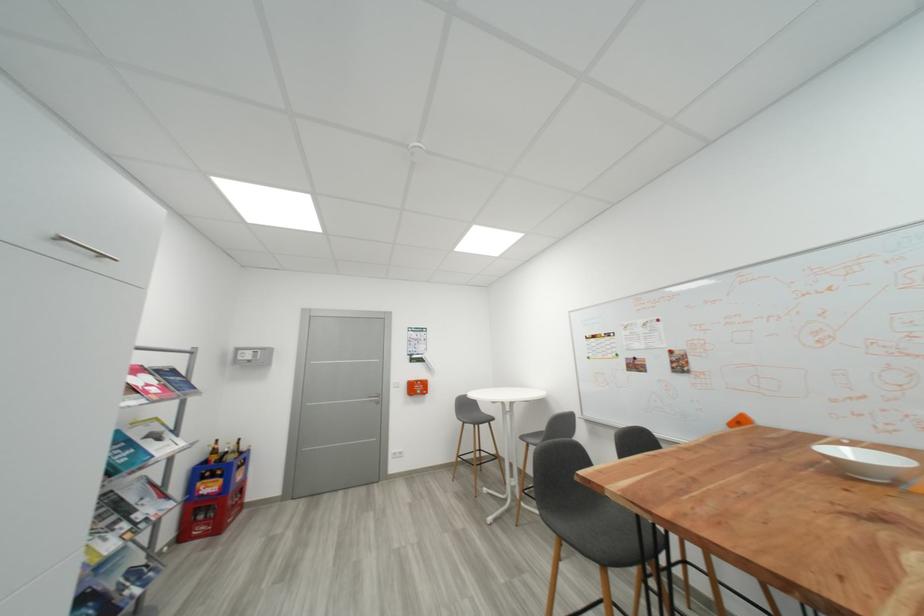
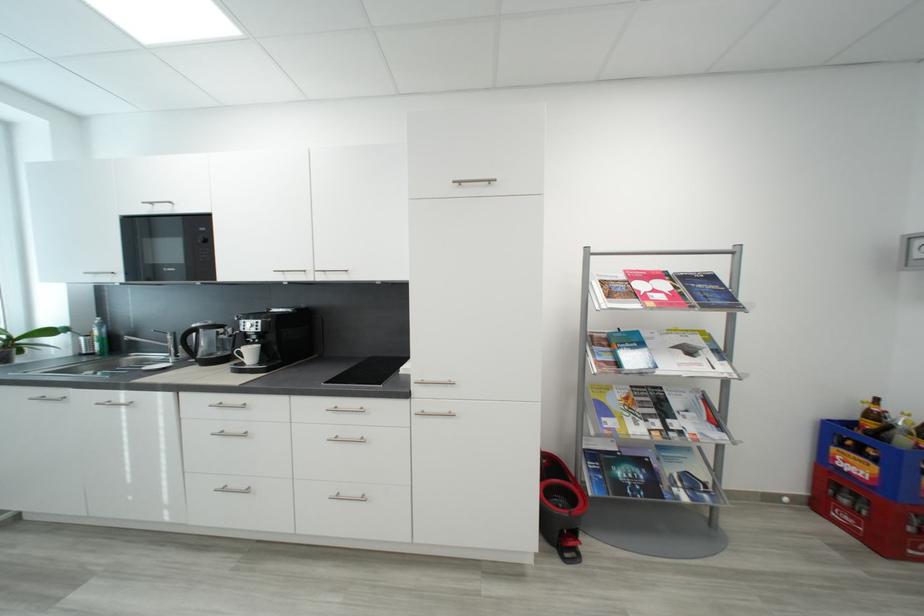
The point at (223, 454) is marked in the first image. Where is the corresponding point in the second image?

(881, 418)